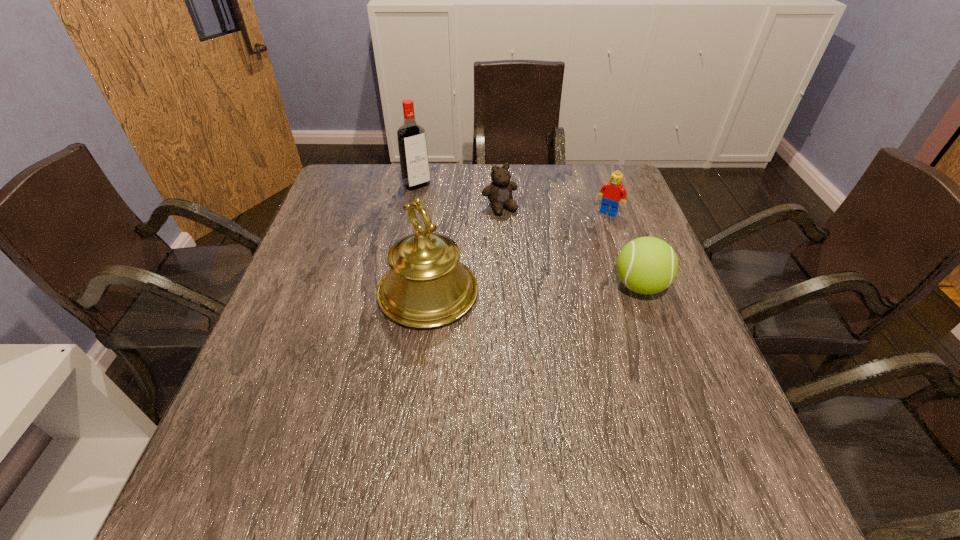
The width and height of the screenshot is (960, 540). Find the location of `free spot located on the front and back of the vodka`. free spot located on the front and back of the vodka is located at coordinates (492, 265).

Where is `free location located 0.140m on the front and back of the vodka`? The image size is (960, 540). free location located 0.140m on the front and back of the vodka is located at coordinates click(444, 214).

The image size is (960, 540). I want to click on free space located on the front and back of the vodka, so click(456, 227).

Locate an element on the screen. This screenshot has height=540, width=960. vacant space located on the face of the teddy bear is located at coordinates [552, 278].

Image resolution: width=960 pixels, height=540 pixels. Find the location of `vacant position located on the face of the teddy bear`. vacant position located on the face of the teddy bear is located at coordinates (538, 258).

Identify the location of free space located on the face of the teddy bear. This screenshot has height=540, width=960. (561, 289).

The image size is (960, 540). What are the coordinates of `Lego that is at the far edge` in the screenshot? It's located at (612, 192).

This screenshot has height=540, width=960. In order to click on vodka at the far edge in this screenshot , I will do `click(413, 154)`.

Where is `teddy bear located in the far edge section of the desktop`? teddy bear located in the far edge section of the desktop is located at coordinates (499, 192).

Locate an element on the screen. tennis ball that is at the right edge is located at coordinates (647, 265).